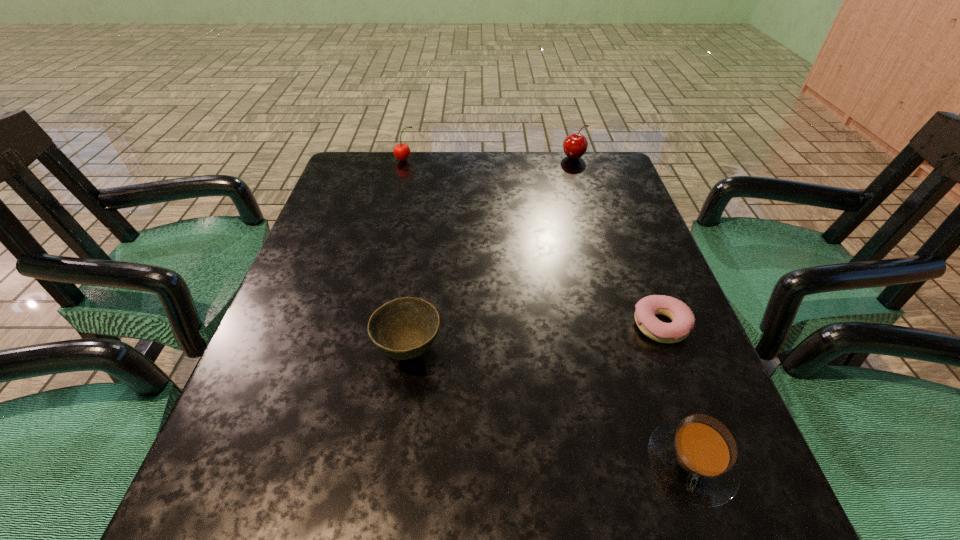
Identify the location of free location located on the left of the doughnut. (441, 325).

This screenshot has height=540, width=960. What are the coordinates of `object located in the near edge section of the desktop` in the screenshot? It's located at (695, 458).

Find the location of `object present at the left edge`. object present at the left edge is located at coordinates (401, 151).

Image resolution: width=960 pixels, height=540 pixels. I want to click on cherry that is at the right edge, so click(575, 145).

At what (x,y) coordinates should I click in order to perform the action: click on cappuccino at the right edge. Please return your answer as a coordinate pair (x, y). The height and width of the screenshot is (540, 960). Looking at the image, I should click on (695, 458).

Identify the location of doughnut positioned at the right edge. (683, 321).

You are a GUI agent. You are given a task and a screenshot of the screen. Output one action in this format:
    pyautogui.click(x=<x>, y=<y>)
    Task: Click on the object at the far left corner
    
    Given the screenshot: What is the action you would take?
    pyautogui.click(x=401, y=151)

The height and width of the screenshot is (540, 960). Find the location of `object that is positioned at the far right corner`. object that is positioned at the far right corner is located at coordinates (575, 145).

Where is `object at the near right corner`? object at the near right corner is located at coordinates (695, 458).

Identify the location of vacant space at the far edge. The width and height of the screenshot is (960, 540). (527, 180).